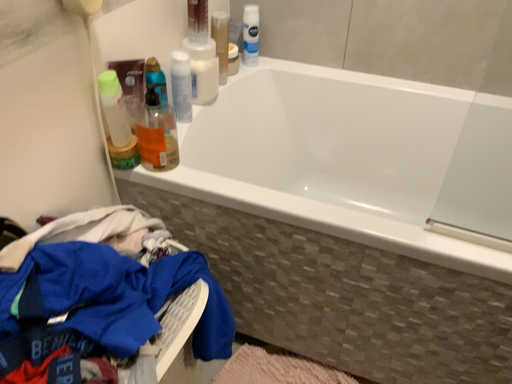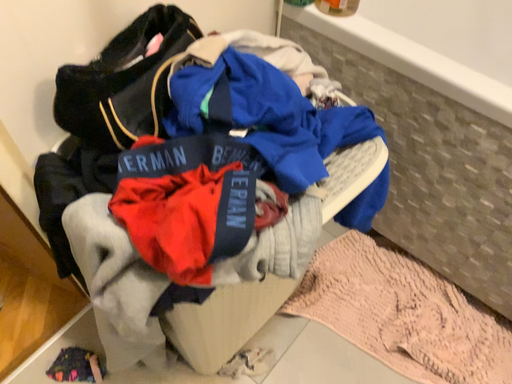
Question: Which way did the camera rotate in the video?

Choices:
 (A) rotated downward
 (B) rotated upward

Answer: (A)